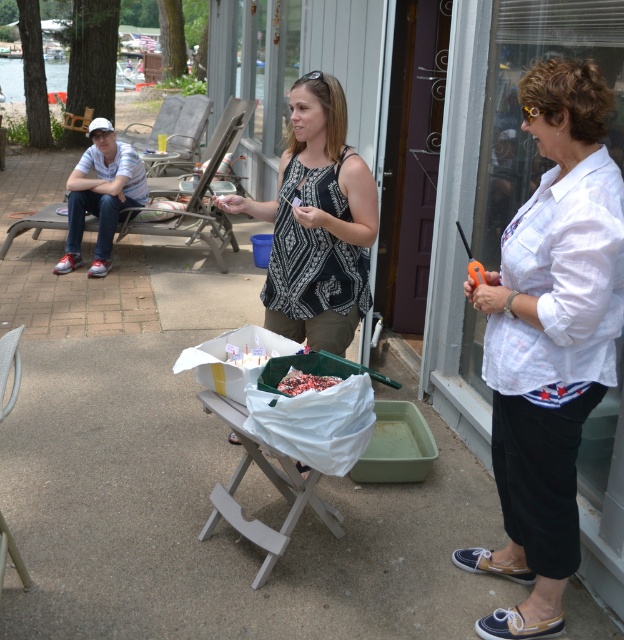
Question: Considering the real-world distances, which object is closest to the chocolate cake at center?

Choices:
 (A) white cotton shirt at center
 (B) patterned fabric tank top at center

Answer: (B)

Question: Observing the image, what is the correct spatial positioning of patterned fabric tank top at center in reference to chocolate cake at center?

Choices:
 (A) left
 (B) right

Answer: (A)

Question: Is the position of patterned fabric tank top at center more distant than that of chocolate cake at center?

Choices:
 (A) yes
 (B) no

Answer: (A)

Question: Among these objects, which one is farthest from the camera?

Choices:
 (A) white cotton shirt at center
 (B) chocolate cake at center

Answer: (B)

Question: Is patterned fabric tank top at center below chocolate cake at center?

Choices:
 (A) no
 (B) yes

Answer: (A)

Question: Which point is farther to the camera?

Choices:
 (A) (369, 216)
 (B) (475, 291)
 (C) (312, 380)

Answer: (A)